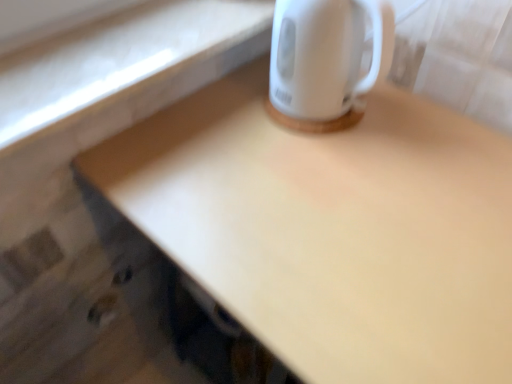
I want to click on white glossy electric kettle at upper right, so click(325, 61).

Image resolution: width=512 pixels, height=384 pixels. What do you see at coordinates (325, 61) in the screenshot?
I see `white glossy electric kettle at upper right` at bounding box center [325, 61].

What do you see at coordinates (332, 229) in the screenshot? This screenshot has height=384, width=512. I see `matte white desk at upper right` at bounding box center [332, 229].

Where is `matte white desk at upper right`? The height and width of the screenshot is (384, 512). matte white desk at upper right is located at coordinates (332, 229).

At what (x,y) coordinates should I click in order to perform the action: click on white glossy electric kettle at upper right. Please return your answer as a coordinate pair (x, y). This screenshot has width=512, height=384. Looking at the image, I should click on (325, 61).

Is white glossy electric kettle at upper right to the left or to the right of matte white desk at upper right in the image?

Clearly, white glossy electric kettle at upper right is on the left of matte white desk at upper right in the image.

Which object is closer to the camera, white glossy electric kettle at upper right or matte white desk at upper right?

matte white desk at upper right is more forward.

Does point (352, 18) come in front of point (319, 210)?

No.

From the image's perspective, is white glossy electric kettle at upper right above or below matte white desk at upper right?

Clearly, from the image's perspective, white glossy electric kettle at upper right is above matte white desk at upper right.

Looking at this image, from a real-world perspective, is white glossy electric kettle at upper right positioned above or below matte white desk at upper right?

In terms of real-world spatial position, white glossy electric kettle at upper right is above matte white desk at upper right.

Which of these two, white glossy electric kettle at upper right or matte white desk at upper right, is wider?

Wider between the two is matte white desk at upper right.

Who is taller, white glossy electric kettle at upper right or matte white desk at upper right?

matte white desk at upper right is taller.

From the picture: Which of these two, white glossy electric kettle at upper right or matte white desk at upper right, is smaller?

white glossy electric kettle at upper right.

Is white glossy electric kettle at upper right surrounding matte white desk at upper right?

That's incorrect, matte white desk at upper right is not inside white glossy electric kettle at upper right.

Can you see white glossy electric kettle at upper right touching matte white desk at upper right?

white glossy electric kettle at upper right is not next to matte white desk at upper right, and they're not touching.

Is white glossy electric kettle at upper right facing towards matte white desk at upper right?

No, white glossy electric kettle at upper right is not oriented towards matte white desk at upper right.

Measure the distance between white glossy electric kettle at upper right and matte white desk at upper right.

white glossy electric kettle at upper right and matte white desk at upper right are 6.71 inches apart from each other.

Where is `desk below the white glossy electric kettle at upper right (from the image's perspective)`? desk below the white glossy electric kettle at upper right (from the image's perspective) is located at coordinates (332, 229).

Between matte white desk at upper right and white glossy electric kettle at upper right, which one appears on the right side from the viewer's perspective?

From the viewer's perspective, matte white desk at upper right appears more on the right side.

Is matte white desk at upper right further to the viewer compared to white glossy electric kettle at upper right?

No, matte white desk at upper right is closer to the camera.

Which is in front, point (450, 260) or point (298, 40)?

The point (450, 260) is closer to the camera.

From the image's perspective, which is above, matte white desk at upper right or white glossy electric kettle at upper right?

white glossy electric kettle at upper right is shown above in the image.

From a real-world perspective, is matte white desk at upper right on white glossy electric kettle at upper right?

No, from a real-world perspective, matte white desk at upper right is not on top of white glossy electric kettle at upper right.

Is matte white desk at upper right wider than white glossy electric kettle at upper right?

Yes, matte white desk at upper right is wider than white glossy electric kettle at upper right.

Does matte white desk at upper right have a greater height compared to white glossy electric kettle at upper right?

Yes, matte white desk at upper right is taller than white glossy electric kettle at upper right.

Who is bigger, matte white desk at upper right or white glossy electric kettle at upper right?

matte white desk at upper right is bigger.

Does matte white desk at upper right contain white glossy electric kettle at upper right?

No.

Is matte white desk at upper right directly adjacent to white glossy electric kettle at upper right?

No, matte white desk at upper right is not touching white glossy electric kettle at upper right.

Is matte white desk at upper right facing away from white glossy electric kettle at upper right?

No, matte white desk at upper right is not facing away from white glossy electric kettle at upper right.

What's the angular difference between matte white desk at upper right and white glossy electric kettle at upper right's facing directions?

They differ by 5.97 degrees in their facing directions.

The height and width of the screenshot is (384, 512). Find the location of `coffee cup that appears on the left of matte white desk at upper right`. coffee cup that appears on the left of matte white desk at upper right is located at coordinates (325, 61).

Locate an element on the screen. desk located below the white glossy electric kettle at upper right (from the image's perspective) is located at coordinates (332, 229).

In the image, there is a white glossy electric kettle at upper right. Where is `desk below it (from a real-world perspective)`? Image resolution: width=512 pixels, height=384 pixels. desk below it (from a real-world perspective) is located at coordinates (332, 229).